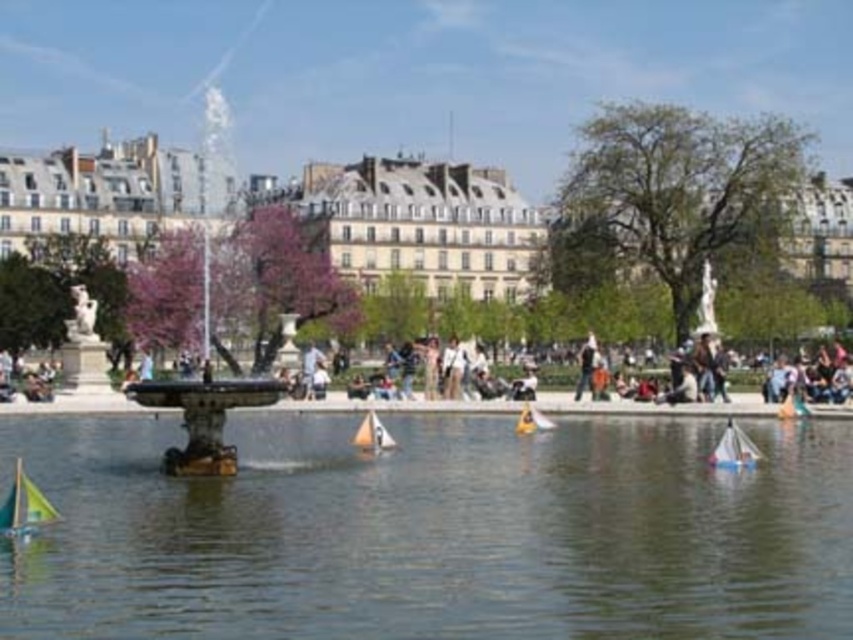
You are a park visitor who wants to place the dark brown leather jacket at center on the white plastic sailboat at lower right. Is the sailboat wide enough to hold the jacket?

The white plastic sailboat at lower right is wider than the dark brown leather jacket at center, so yes, the sailboat can hold the jacket.

You are a park visitor who wants to place your dark brown leather jacket on a surface. Given the scene, can you safely put your dark brown leather jacket at center on the stone fountain at center?

The stone fountain at center is larger in size than the dark brown leather jacket at center, so yes, the jacket can be placed on the stone fountain at center as it has enough space to accommodate it.

You are standing in the park and see the dark brown leather jacket at center. Where exactly is it located in terms of coordinates?

The dark brown leather jacket at center is located at coordinates point (585, 365).